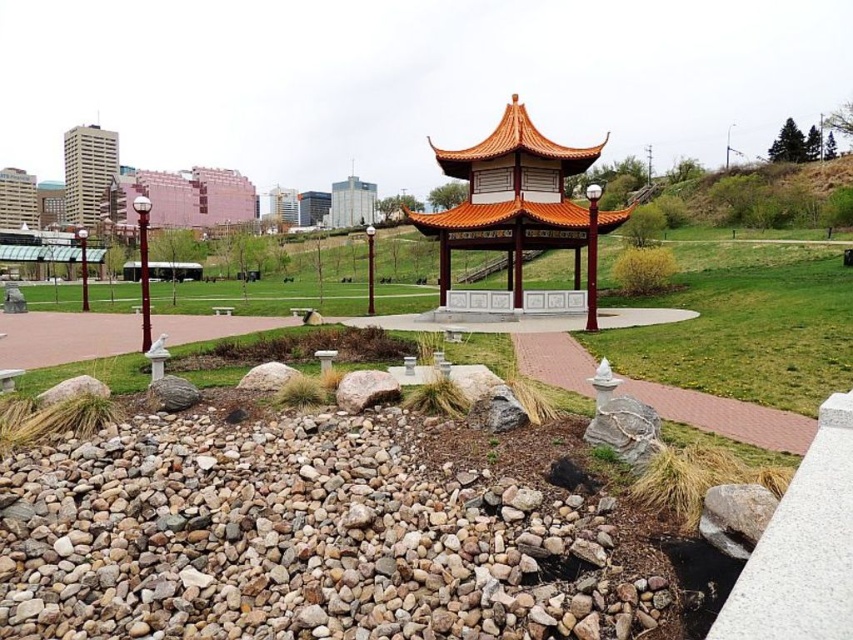
You are planning to place a large decorative fountain in the park. You have two options for placement locations based on the objects in the scene. The first option is near the gray gravel rocks at lower left, and the second option is near the orange wood gazebo at center. Which location has more space to accommodate the fountain?

The orange wood gazebo at center is larger than the gray gravel rocks at lower left, so placing the fountain near the orange wood gazebo at center would provide more space for the fountain.